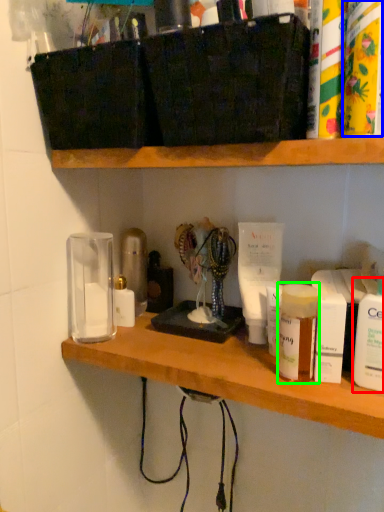
Question: Which is nearer to the toiletry (highlighted by a red box)? toiletry (highlighted by a blue box) or toiletry (highlighted by a green box).

Choices:
 (A) toiletry
 (B) toiletry

Answer: (B)